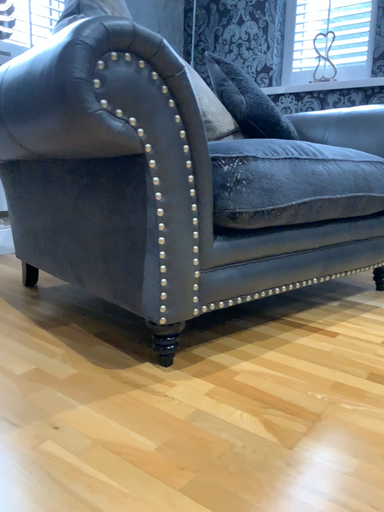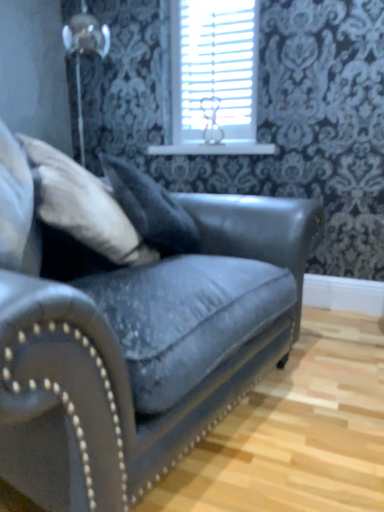
Question: How did the camera likely rotate when shooting the video?

Choices:
 (A) rotated right
 (B) rotated left

Answer: (A)